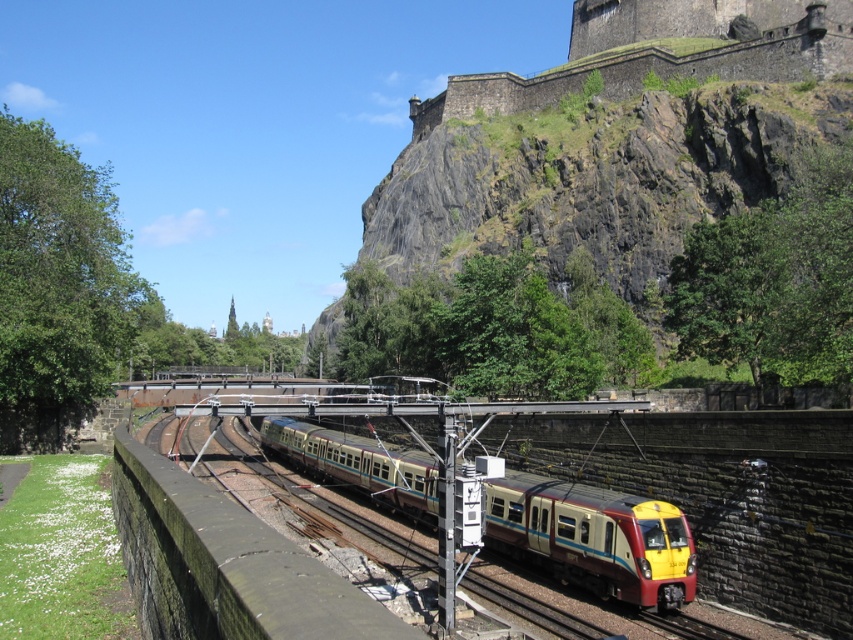
Is yellow polished metal train at center taller than dark stone wall at upper center?

No, yellow polished metal train at center is not taller than dark stone wall at upper center.

Is point (492, 525) more distant than point (630, 76)?

That is False.

Is point (412, 513) more distant than point (622, 49)?

No.

Image resolution: width=853 pixels, height=640 pixels. I want to click on yellow polished metal train at center, so click(595, 538).